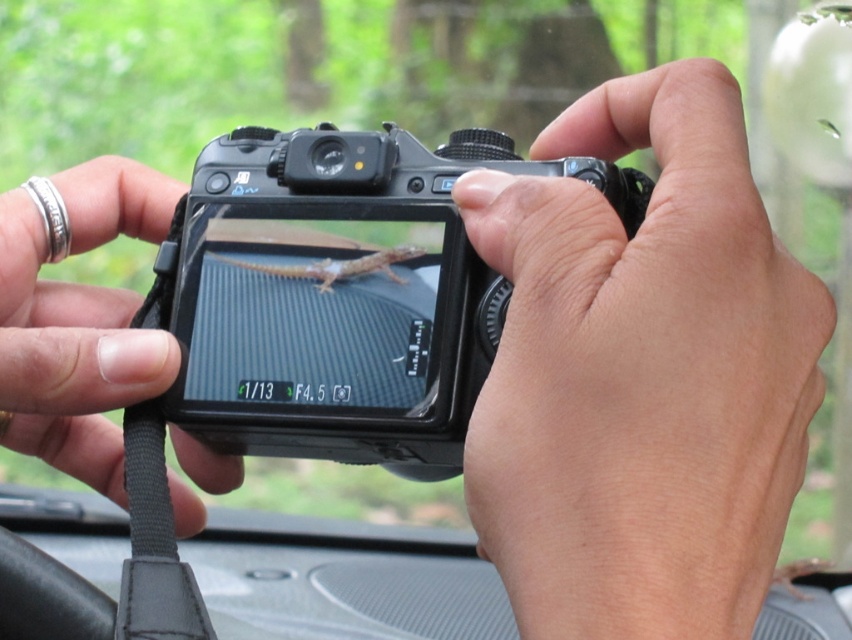
Question: Does smooth skin hand at center appear on the right side of black matte camera at center?

Choices:
 (A) no
 (B) yes

Answer: (B)

Question: Which object appears closest to the camera in this image?

Choices:
 (A) smooth skin hand at center
 (B) silver metallic ring at upper left
 (C) black matte camera at center
 (D) black leather strap at center

Answer: (A)

Question: Is the position of smooth skin hand at center more distant than that of black matte camera at center?

Choices:
 (A) no
 (B) yes

Answer: (A)

Question: Does smooth skin hand at center appear on the left side of black matte camera at center?

Choices:
 (A) no
 (B) yes

Answer: (A)

Question: Which point appears closest to the camera in this image?

Choices:
 (A) (165, 275)
 (B) (348, 218)
 (C) (628, 90)
 (D) (47, 289)

Answer: (C)

Question: Which object is the closest to the smooth skin hand at center?

Choices:
 (A) black matte camera at center
 (B) black leather strap at center
 (C) silver metallic ring at upper left

Answer: (A)